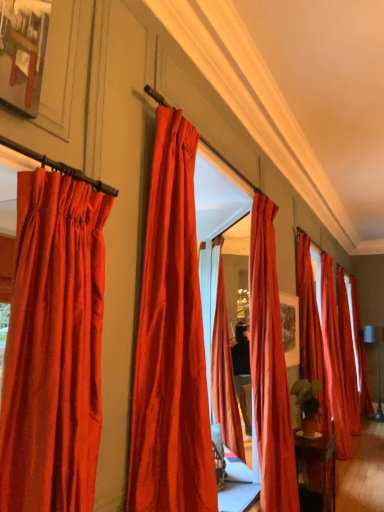
Question: Should I look upward or downward to see satin red curtain at left, the 1th curtain in the left-to-right sequence?

Choices:
 (A) up
 (B) down

Answer: (B)

Question: Considering the relative positions of satin red curtain at right, the 2th curtain positioned from the back, and satin red curtain at center, positioned as the 3th curtain in front-to-back order, in the image provided, is satin red curtain at right, the 2th curtain positioned from the back, in front of satin red curtain at center, positioned as the 3th curtain in front-to-back order,?

Choices:
 (A) no
 (B) yes

Answer: (A)

Question: Is satin red curtain at right, marked as the sixth curtain in a left-to-right arrangement, thinner than satin red curtain at center, which ranks as the 3th curtain in left-to-right order?

Choices:
 (A) yes
 (B) no

Answer: (A)

Question: Are satin red curtain at right, the 2th curtain positioned from the back, and satin red curtain at center, which ranks as the 3th curtain in left-to-right order, located far from each other?

Choices:
 (A) yes
 (B) no

Answer: (A)

Question: Is satin red curtain at right, the 2th curtain positioned from the back, turned away from satin red curtain at center, positioned as the 3th curtain in front-to-back order?

Choices:
 (A) no
 (B) yes

Answer: (A)

Question: Could you tell me if satin red curtain at right, which appears as the 2th curtain when viewed from the right, is turned towards satin red curtain at center, the fifth curtain positioned from the back?

Choices:
 (A) no
 (B) yes

Answer: (A)

Question: From the image's perspective, is satin red curtain at right, marked as the sixth curtain in a left-to-right arrangement, over satin red curtain at center, positioned as the 3th curtain in front-to-back order?

Choices:
 (A) no
 (B) yes

Answer: (A)

Question: Can you confirm if satin red curtain at center, the 6th curtain when ordered from back to front, is smaller than satin red curtain at center, the fifth curtain positioned from the back?

Choices:
 (A) yes
 (B) no

Answer: (A)

Question: Is satin red curtain at center, positioned as the 3th curtain in front-to-back order, at the back of satin red curtain at center, the 2th curtain viewed from the front?

Choices:
 (A) no
 (B) yes

Answer: (A)

Question: Is satin red curtain at center, the 2th curtain viewed from the front, not close to satin red curtain at center, which appears as the fifth curtain when viewed from the right?

Choices:
 (A) yes
 (B) no

Answer: (A)

Question: Could you tell me if satin red curtain at center, the 2th curtain viewed from the front, is facing satin red curtain at center, the fifth curtain positioned from the back?

Choices:
 (A) yes
 (B) no

Answer: (B)

Question: From a real-world perspective, is satin red curtain at center, the 6th curtain when ordered from back to front, beneath satin red curtain at center, positioned as the 3th curtain in front-to-back order?

Choices:
 (A) no
 (B) yes

Answer: (A)

Question: Is satin red curtain at center, which is the 2th curtain in left-to-right order, wider than satin red curtain at center, the fifth curtain positioned from the back?

Choices:
 (A) yes
 (B) no

Answer: (A)

Question: Is satin red curtain at center, which appears as the fifth curtain when viewed from the right, positioned behind satin red curtain at right, the 3th curtain positioned from the back?

Choices:
 (A) no
 (B) yes

Answer: (A)